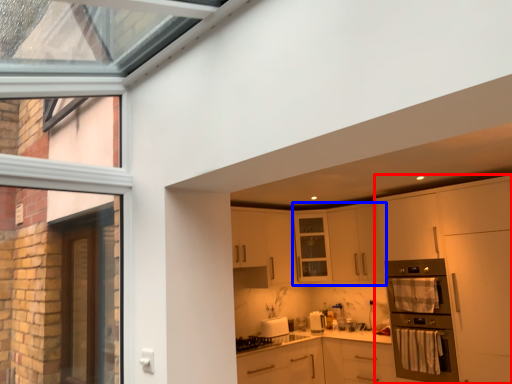
Question: Which object is closer to the camera taking this photo, cabinetry (highlighted by a red box) or cabinetry (highlighted by a blue box)?

Choices:
 (A) cabinetry
 (B) cabinetry

Answer: (A)